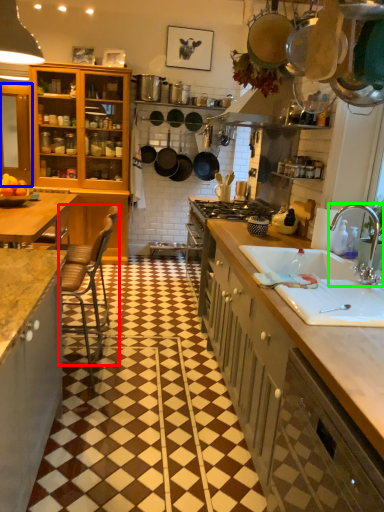
Question: Which is farther away from chair (highlighted by a red box)? cabinetry (highlighted by a blue box) or tap (highlighted by a green box)?

Choices:
 (A) cabinetry
 (B) tap

Answer: (A)